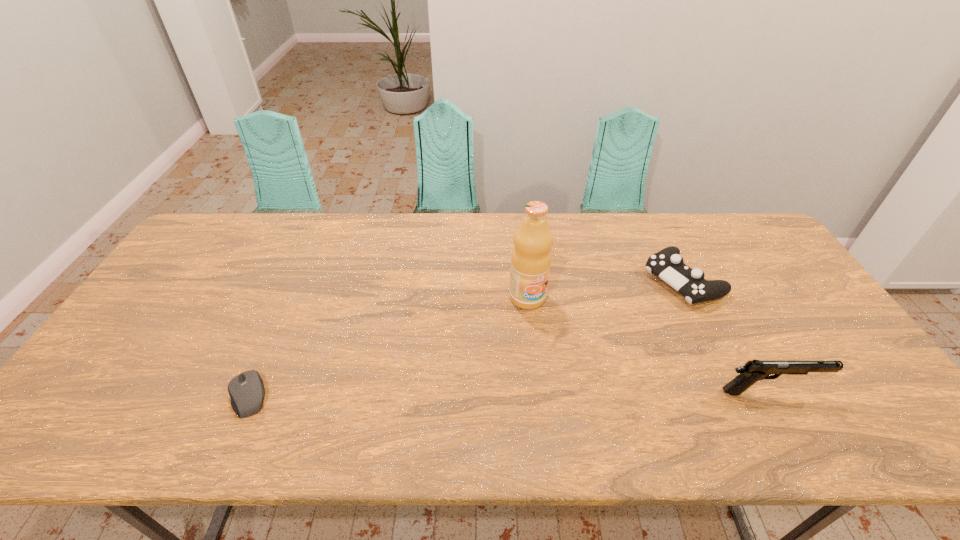
Find the location of a particular element. free space on the desktop that is between the leftmost object and the second tallest object and is positioned on the front label of the fruit juice is located at coordinates (587, 393).

Locate an element on the screen. The image size is (960, 540). vacant space on the desktop that is between the leftmost object and the gun and is positioned on the surface of the second shortest object is located at coordinates (467, 394).